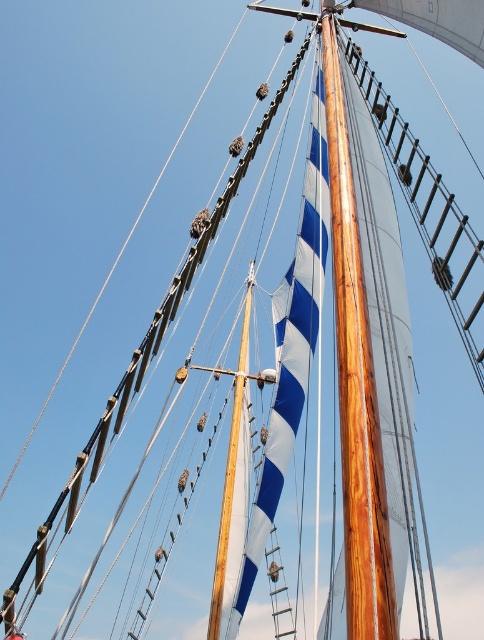
You are a sailor on a ship and need to climb up to the shiny polished wood mast at center and the wooden mast at center. Which mast will require a longer climb? Please explain your reasoning based on their positions.

Both the shiny polished wood mast at center and the wooden mast at center are the same mast. The description states they are 54.67 meters apart, but since they share the same position at the center, this might be a mistake. Assuming they are separate, the one requiring a longer climb would depend on their height, but the given data only specifies their separation distance, not height. Without height information, we cannot determine which requires a longer climb.

You are standing on the deck of the ship and notice two masts in front of you. Which one is the shiny polished wood mast at center closer to you compared to the wooden mast at center?

The shiny polished wood mast at center is closer to the viewer than the wooden mast at center.

You are standing on the deck of the ship and want to climb the shiny polished wood mast at center. Considering the height of the mast, do you think you can reach the top without any assistance?

The shiny polished wood mast at center is 73.09 feet away from the camera, but this distance refers to how far the mast is from the viewer, not its actual height. The height of the mast itself isn